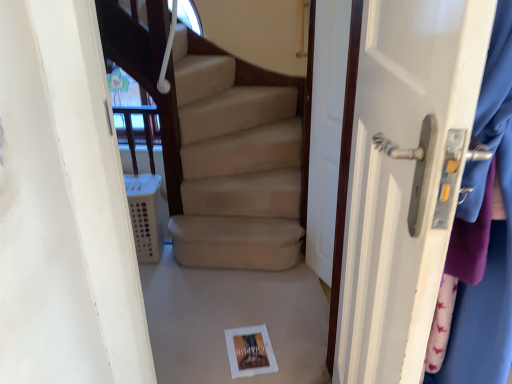
Consider the image. Measure the distance between point (x=410, y=233) and camera.

They are 26.57 inches apart.

The width and height of the screenshot is (512, 384). Find the location of `white glossy door handle at right`. white glossy door handle at right is located at coordinates (402, 178).

Image resolution: width=512 pixels, height=384 pixels. What do you see at coordinates (402, 178) in the screenshot?
I see `white glossy door handle at right` at bounding box center [402, 178].

This screenshot has height=384, width=512. I want to click on white glossy door handle at right, so click(x=402, y=178).